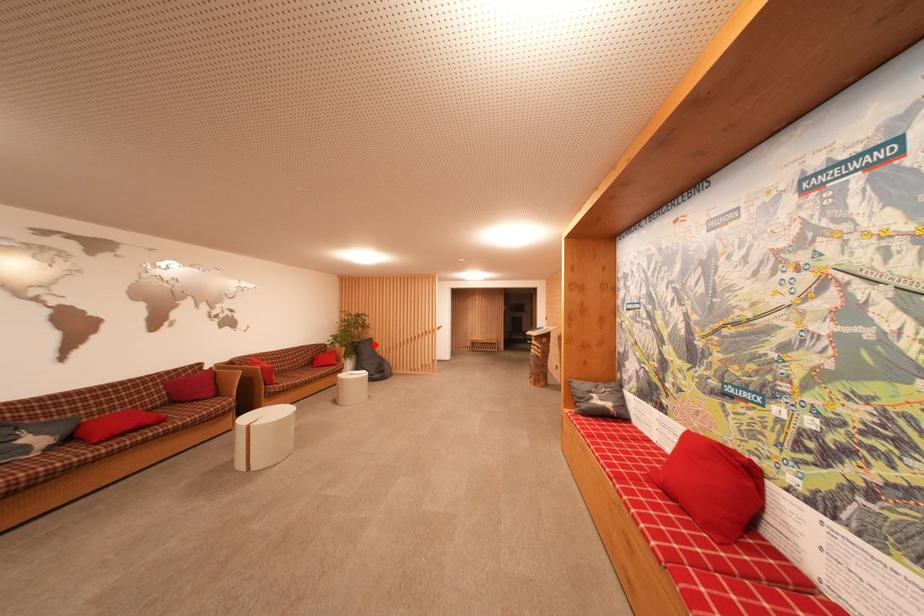
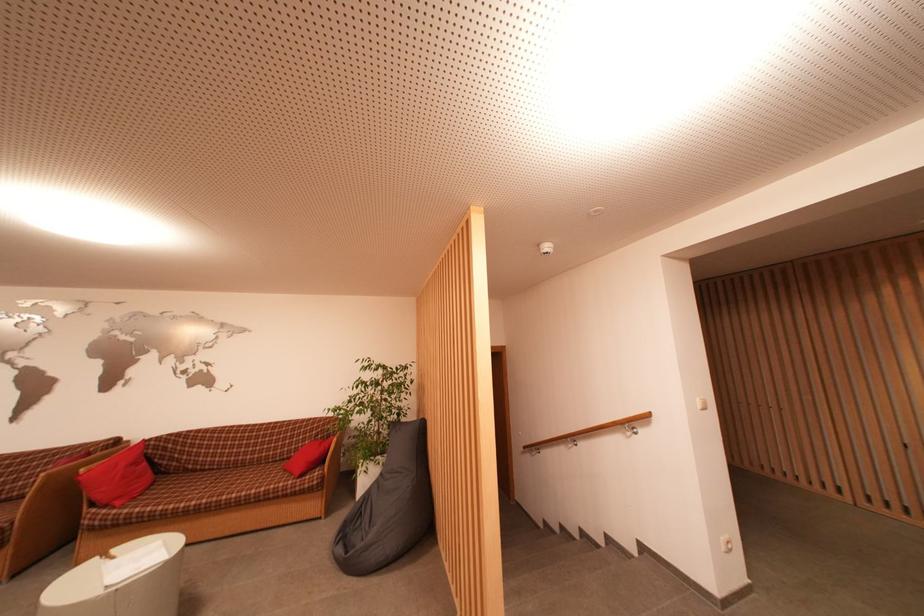
In the second image, find the point that corresponds to the highlighted location in the first image.

(426, 430)